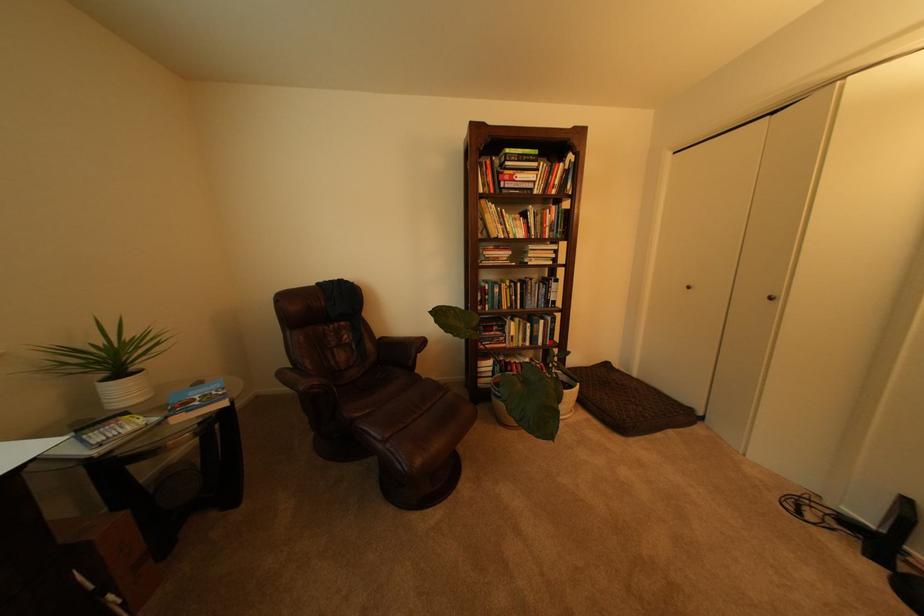
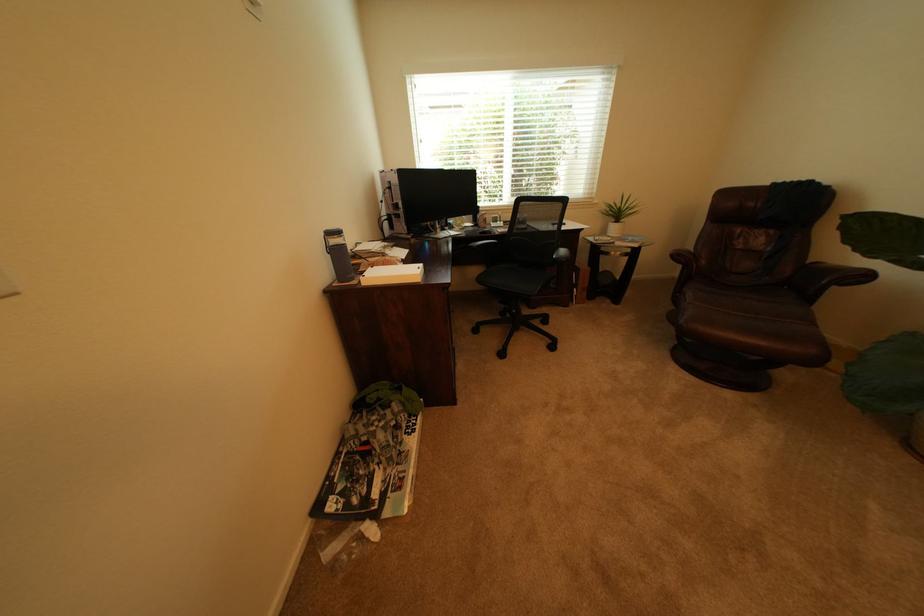
Question: I am providing you with two images of the same scene from different viewpoints. After the viewpoint changes to image2, which objects are now occluded?

Choices:
 (A) black computer mouse
 (B) brown recliner sitting surface
 (C) black chair sitting surface
 (D) none of these

Answer: (D)